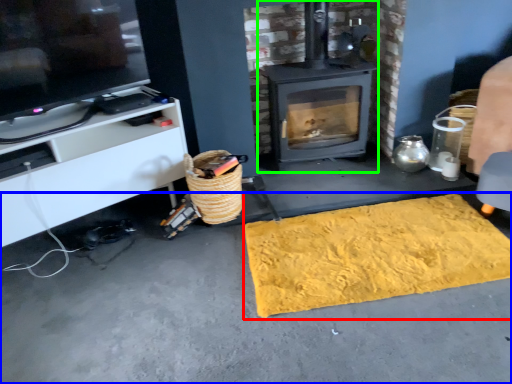
Question: Estimate the real-world distances between objects in this image. Which object is closer to mat (highlighted by a red box), concrete (highlighted by a blue box) or wood burning stove (highlighted by a green box)?

Choices:
 (A) concrete
 (B) wood burning stove

Answer: (A)